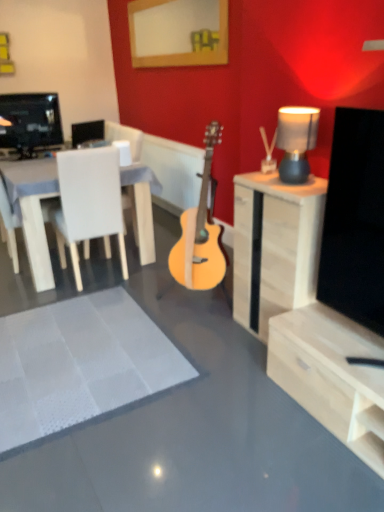
Question: Should I look upward or downward to see matte gray lampshade at upper right?

Choices:
 (A) up
 (B) down

Answer: (A)

Question: Considering the relative sizes of light wood acoustic guitar at center and wooden picture frame at upper center in the image provided, is light wood acoustic guitar at center bigger than wooden picture frame at upper center?

Choices:
 (A) yes
 (B) no

Answer: (A)

Question: Does light wood acoustic guitar at center have a greater width compared to wooden picture frame at upper center?

Choices:
 (A) no
 (B) yes

Answer: (B)

Question: Is light wood acoustic guitar at center placed right next to wooden picture frame at upper center?

Choices:
 (A) yes
 (B) no

Answer: (B)

Question: Is light wood acoustic guitar at center to the right of wooden picture frame at upper center from the viewer's perspective?

Choices:
 (A) no
 (B) yes

Answer: (B)

Question: From a real-world perspective, does light wood acoustic guitar at center sit lower than wooden picture frame at upper center?

Choices:
 (A) no
 (B) yes

Answer: (B)

Question: Does light wood acoustic guitar at center have a lesser height compared to wooden picture frame at upper center?

Choices:
 (A) yes
 (B) no

Answer: (B)

Question: From the image's perspective, is white textured rug at center under light wood cabinet at right?

Choices:
 (A) yes
 (B) no

Answer: (A)

Question: Considering the relative positions of white textured rug at center and light wood cabinet at right in the image provided, is white textured rug at center to the left of light wood cabinet at right from the viewer's perspective?

Choices:
 (A) yes
 (B) no

Answer: (A)

Question: From a real-world perspective, is white textured rug at center located beneath light wood cabinet at right?

Choices:
 (A) yes
 (B) no

Answer: (A)

Question: Is white textured rug at center shorter than light wood cabinet at right?

Choices:
 (A) yes
 (B) no

Answer: (A)

Question: Is white textured rug at center smaller than light wood cabinet at right?

Choices:
 (A) no
 (B) yes

Answer: (B)

Question: Considering the relative positions of white textured rug at center and light wood cabinet at right in the image provided, is white textured rug at center behind light wood cabinet at right?

Choices:
 (A) no
 (B) yes

Answer: (A)

Question: Is light wood acoustic guitar at center aimed at matte gray lampshade at upper right?

Choices:
 (A) no
 (B) yes

Answer: (A)